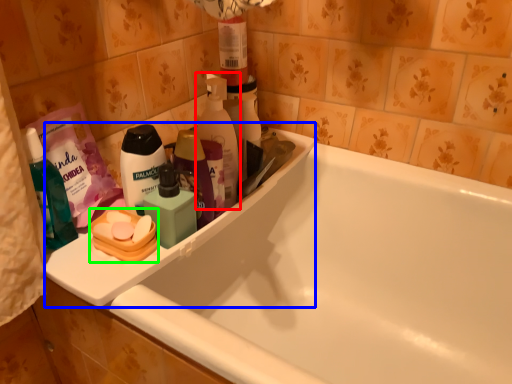
Question: Based on their relative distances, which object is nearer to cleaning product (highlighted by a red box)? Choose from sink (highlighted by a blue box) and personal care (highlighted by a green box).

Choices:
 (A) sink
 (B) personal care

Answer: (A)